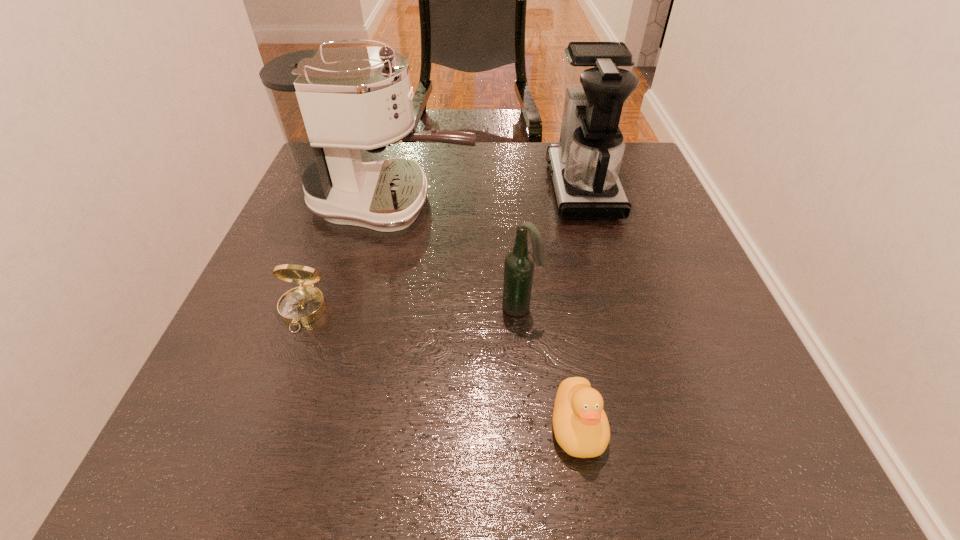
Identify the location of vacant space that satisfies the following two spatial constraints: 1. on the front-facing side of the left coffee maker; 2. on the right side of the third shortest object. (367, 307).

Where is `vacant position in the image that satisfies the following two spatial constraints: 1. at the front of the right coffee maker where the controls are located; 2. with the dial facing the compass`? Image resolution: width=960 pixels, height=540 pixels. vacant position in the image that satisfies the following two spatial constraints: 1. at the front of the right coffee maker where the controls are located; 2. with the dial facing the compass is located at coordinates (617, 311).

What are the coordinates of `vacant point that satisfies the following two spatial constraints: 1. on the front-facing side of the left coffee maker; 2. with the dial facing the compass` in the screenshot? It's located at (366, 311).